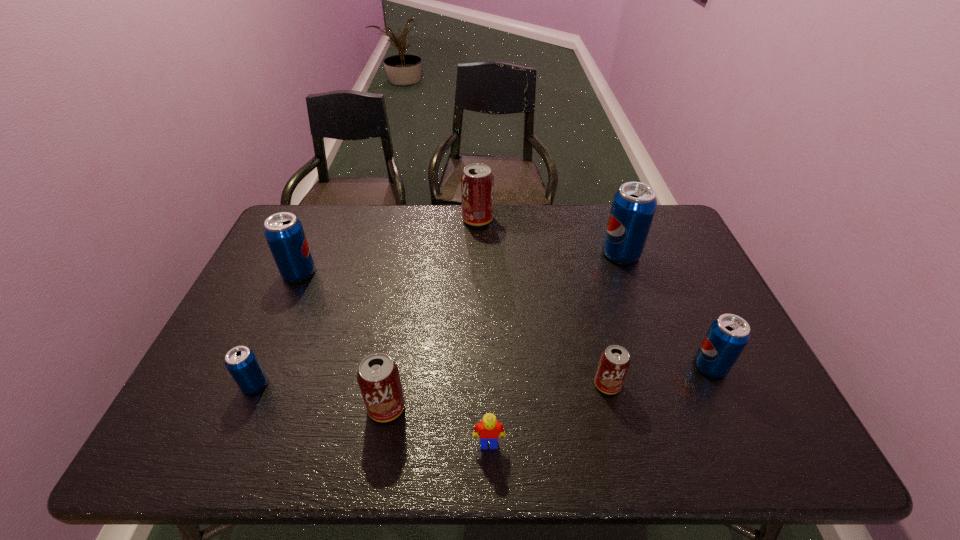
Locate an element on the screen. the third object from right to left is located at coordinates (614, 363).

Where is `the smallest red soda can`? The image size is (960, 540). the smallest red soda can is located at coordinates pyautogui.click(x=614, y=363).

The height and width of the screenshot is (540, 960). In order to click on Lego in this screenshot , I will do `click(489, 429)`.

Locate an element on the screen. This screenshot has height=540, width=960. yellow Lego is located at coordinates (489, 429).

At what (x,y) coordinates should I click in order to perform the action: click on vacant area located on the left of the tallest soda can. Please return your answer as a coordinate pair (x, y). Looking at the image, I should click on (573, 253).

I want to click on blank space located on the left of the farthest soda can, so click(428, 219).

Find the location of a particular element. vacant point located 0.080m on the right of the third smallest blue pop soda is located at coordinates (342, 273).

Identify the location of vacant space located on the back of the third biggest blue pop soda. (660, 256).

Locate an element on the screen. Image resolution: width=960 pixels, height=540 pixels. vacant space situated on the right of the sixth object from right to left is located at coordinates (484, 407).

The image size is (960, 540). What are the coordinates of `free space located 0.100m on the front of the smallest blue pop soda` in the screenshot? It's located at (232, 436).